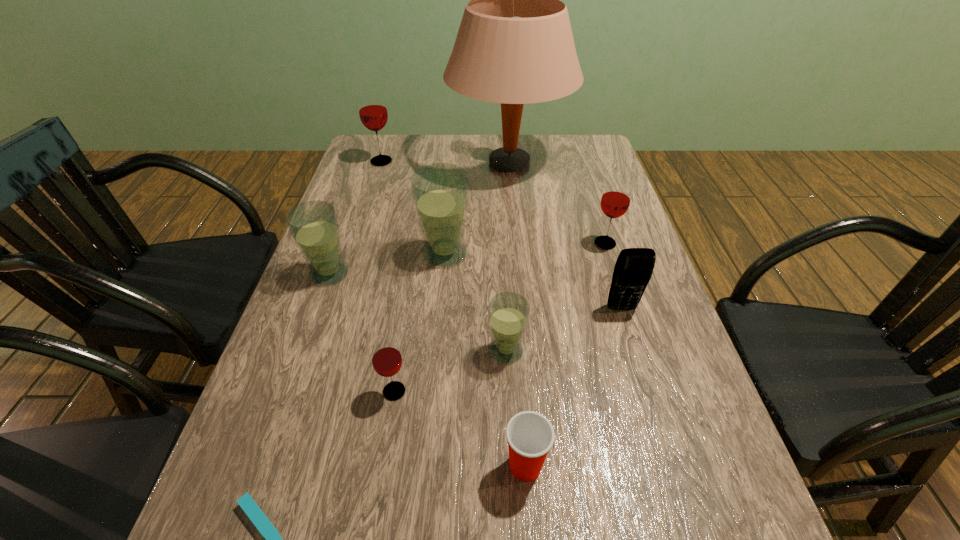
At what (x,y) coordinates should I click in order to perform the action: click on free space between the ninth farthest object and the leftmost blue glass. Please return your answer as a coordinate pair (x, y). The image size is (960, 540). Looking at the image, I should click on (427, 370).

Where is `blank region between the nearest blue glass and the biggest blue glass`? This screenshot has width=960, height=540. blank region between the nearest blue glass and the biggest blue glass is located at coordinates (475, 302).

Find the location of a particular element. This screenshot has height=540, width=960. vacant area between the nearest glass and the tallest object is located at coordinates (451, 277).

Image resolution: width=960 pixels, height=540 pixels. What are the coordinates of `object that is the closest to the second blue glass from left to right` in the screenshot? It's located at (314, 225).

Locate an element on the screen. The image size is (960, 540). the fourth closest object relative to the nearest red glass is located at coordinates (314, 225).

Choose which glass is the fourth nearest neighbor to the ninth farthest object. Please provide its 2D coordinates. Your answer should be formatted as a tuple, i.e. [(x, y)], where the tuple contains the x and y coordinates of a point satisfying the conditions above.

[(314, 225)]

Image resolution: width=960 pixels, height=540 pixels. I want to click on glass that is the closest to the ninth farthest object, so click(x=508, y=312).

Choose which red glass is the second nearest neighbor to the Dixie cup. Please provide its 2D coordinates. Your answer should be formatted as a tuple, i.e. [(x, y)], where the tuple contains the x and y coordinates of a point satisfying the conditions above.

[(615, 201)]

Find the location of a particular element. the second closest red glass to the second smallest blue glass is located at coordinates (373, 113).

The height and width of the screenshot is (540, 960). In order to click on blue glass that is the closest one to the Dixie cup in this screenshot , I will do `click(508, 312)`.